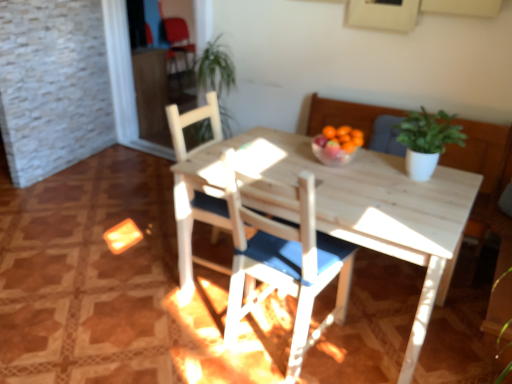
Question: Is matte red armchair at upper left next to white wood chair at center, the 1th chair viewed from the front?

Choices:
 (A) yes
 (B) no

Answer: (B)

Question: From a real-world perspective, is matte red armchair at upper left over white wood chair at center, the 1th chair viewed from the front?

Choices:
 (A) yes
 (B) no

Answer: (B)

Question: From a real-world perspective, is matte red armchair at upper left under white wood chair at center, the second chair when ordered from back to front?

Choices:
 (A) no
 (B) yes

Answer: (B)

Question: Considering the relative sizes of matte red armchair at upper left and white wood chair at center, the second chair when ordered from back to front, in the image provided, is matte red armchair at upper left smaller than white wood chair at center, the second chair when ordered from back to front,?

Choices:
 (A) no
 (B) yes

Answer: (A)

Question: Is matte red armchair at upper left wider than white wood chair at center, the second chair when ordered from back to front?

Choices:
 (A) no
 (B) yes

Answer: (B)

Question: Considering the positions of white wood chair at center, the first chair positioned from the back, and white wood chair at center, the 1th chair viewed from the front, in the image, is white wood chair at center, the first chair positioned from the back, wider or thinner than white wood chair at center, the 1th chair viewed from the front,?

Choices:
 (A) thin
 (B) wide

Answer: (B)

Question: Based on their positions, is white wood chair at center, arranged as the second chair when viewed from the front, located to the left or right of white wood chair at center, the 1th chair viewed from the front?

Choices:
 (A) left
 (B) right

Answer: (A)

Question: Does point (190, 203) appear closer or farther from the camera than point (292, 271)?

Choices:
 (A) farther
 (B) closer

Answer: (A)

Question: From their relative heights in the image, would you say white wood chair at center, the first chair positioned from the back, is taller or shorter than white wood chair at center, the 1th chair viewed from the front?

Choices:
 (A) short
 (B) tall

Answer: (B)

Question: In the image, is green matte plant at upper right on the left side or the right side of matte red armchair at upper left?

Choices:
 (A) right
 (B) left

Answer: (A)

Question: Considering the positions of point (415, 160) and point (177, 31), is point (415, 160) closer or farther from the camera than point (177, 31)?

Choices:
 (A) farther
 (B) closer

Answer: (B)

Question: Considering the positions of green matte plant at upper right and matte red armchair at upper left in the image, is green matte plant at upper right bigger or smaller than matte red armchair at upper left?

Choices:
 (A) big
 (B) small

Answer: (B)

Question: Relative to matte red armchair at upper left, is green matte plant at upper right in front or behind?

Choices:
 (A) front
 (B) behind

Answer: (A)

Question: Considering the positions of matte red armchair at upper left and white wood chair at center, the 1th chair viewed from the front, in the image, is matte red armchair at upper left taller or shorter than white wood chair at center, the 1th chair viewed from the front,?

Choices:
 (A) tall
 (B) short

Answer: (B)

Question: Relative to white wood chair at center, the second chair when ordered from back to front, is matte red armchair at upper left in front or behind?

Choices:
 (A) behind
 (B) front

Answer: (A)